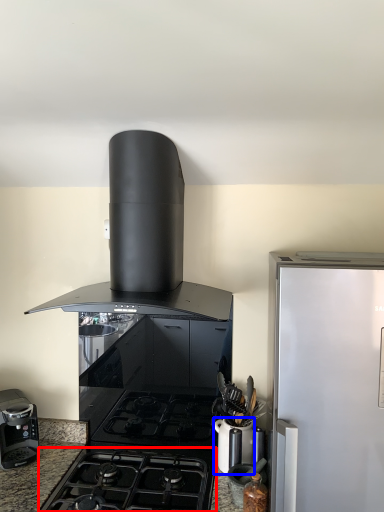
Question: Among these objects, which one is farthest to the camera, gas stove (highlighted by a red box) or kitchen appliance (highlighted by a blue box)?

Choices:
 (A) gas stove
 (B) kitchen appliance

Answer: (B)